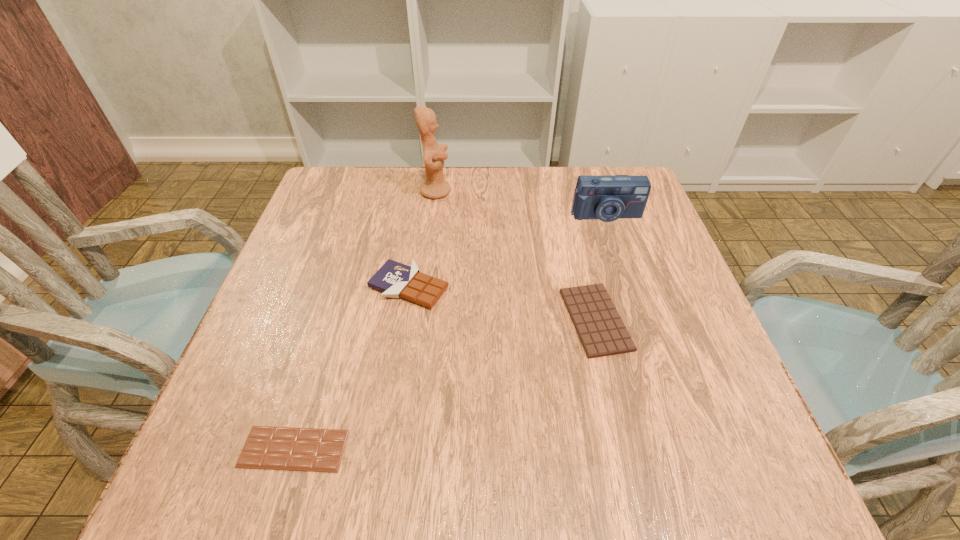
Where is `free spot located on the lens of the second tallest object`? The height and width of the screenshot is (540, 960). free spot located on the lens of the second tallest object is located at coordinates (629, 288).

The height and width of the screenshot is (540, 960). I want to click on free location located 0.340m on the front of the tallest chocolate bar, so tap(378, 484).

You are a GUI agent. You are given a task and a screenshot of the screen. Output one action in this format:
    pyautogui.click(x=<x>, y=<y>)
    Task: Click on the free space located on the back of the rightmost chocolate bar
    The image size is (960, 540).
    Given the screenshot: What is the action you would take?
    pyautogui.click(x=564, y=191)

At what (x,y) coordinates should I click in order to perform the action: click on vacant space situated 0.260m on the right of the nearest object. Please return your answer as a coordinate pair (x, y). Looking at the image, I should click on (511, 449).

I want to click on figurine at the far edge, so click(434, 187).

Locate an element on the screen. camera that is at the far edge is located at coordinates [x=609, y=197].

Locate an element on the screen. This screenshot has height=540, width=960. object situated at the near edge is located at coordinates (275, 448).

The image size is (960, 540). In order to click on object present at the left edge in this screenshot , I will do `click(275, 448)`.

Find the location of `camera present at the right edge`. camera present at the right edge is located at coordinates (609, 197).

This screenshot has width=960, height=540. In order to click on chocolate bar that is at the right edge in this screenshot , I will do pos(597,322).